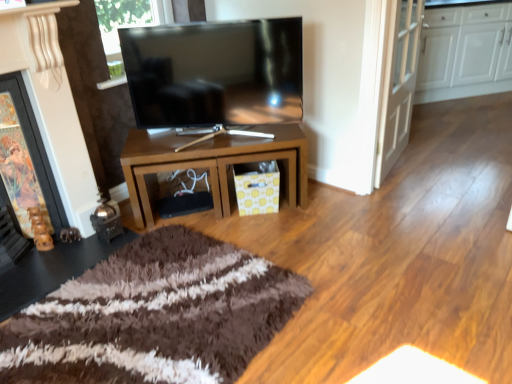
Locate an element on the screen. The image size is (512, 384). free space in front of brown glossy table at center is located at coordinates (246, 260).